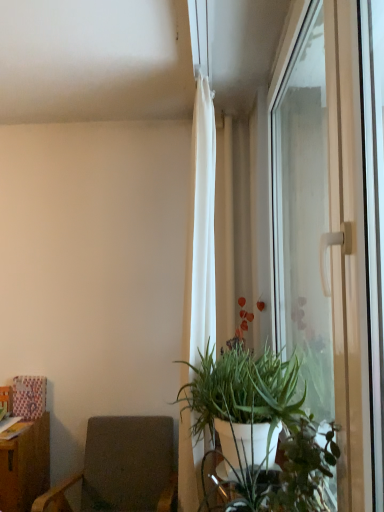
Locate an element on the screen. transparent glass window at right is located at coordinates (335, 233).

Considering the sizes of objects white matte plant pot at lower right and transparent glass window at right in the image provided, who is shorter, white matte plant pot at lower right or transparent glass window at right?

white matte plant pot at lower right is shorter.

Consider the image. Considering their positions, is white matte plant pot at lower right located in front of or behind transparent glass window at right?

white matte plant pot at lower right is positioned farther from the viewer than transparent glass window at right.

The height and width of the screenshot is (512, 384). I want to click on vegetation directly beneath the transparent glass window at right (from a real-world perspective), so click(278, 477).

The width and height of the screenshot is (384, 512). In order to click on vegetation on the right of the dark gray fabric chair at lower left in this screenshot , I will do `click(278, 477)`.

From a real-world perspective, who is located higher, dark gray fabric chair at lower left or white matte plant pot at lower right?

white matte plant pot at lower right is physically above.

Does dark gray fabric chair at lower left have a greater width compared to white matte plant pot at lower right?

Yes.

From the image's perspective, which one is positioned lower, dark gray fabric chair at lower left or white matte plant pot at lower right?

dark gray fabric chair at lower left.

From the image's perspective, who appears lower, green matte plant at center or white matte plant pot at lower right?

green matte plant at center is shown below in the image.

From a real-world perspective, is green matte plant at center located higher than white matte plant pot at lower right?

No, from a real-world perspective, green matte plant at center is not above white matte plant pot at lower right.

How far apart are green matte plant at center and white matte plant pot at lower right?

A distance of 3.08 inches exists between green matte plant at center and white matte plant pot at lower right.

Is green matte plant at center outside of white matte plant pot at lower right?

green matte plant at center is positioned outside white matte plant pot at lower right.

Image resolution: width=384 pixels, height=512 pixels. I want to click on chair below the transparent glass window at right (from a real-world perspective), so [x=122, y=468].

How different are the orientations of dark gray fabric chair at lower left and transparent glass window at right in degrees?

The facing directions of dark gray fabric chair at lower left and transparent glass window at right are 90.3 degrees apart.

Considering the relative sizes of dark gray fabric chair at lower left and transparent glass window at right in the image provided, is dark gray fabric chair at lower left taller than transparent glass window at right?

In fact, dark gray fabric chair at lower left may be shorter than transparent glass window at right.

Is dark gray fabric chair at lower left next to transparent glass window at right and touching it?

dark gray fabric chair at lower left is not next to transparent glass window at right, and they're not touching.

Based on the photo, is green matte plant at center positioned beyond the bounds of white sheer curtain at upper center?

Yes, green matte plant at center is located beyond the bounds of white sheer curtain at upper center.

Can you tell me how much green matte plant at center and white sheer curtain at upper center differ in facing direction?

There is a 0.317-degree angle between the facing directions of green matte plant at center and white sheer curtain at upper center.

Does green matte plant at center appear on the right side of white sheer curtain at upper center?

Correct, you'll find green matte plant at center to the right of white sheer curtain at upper center.

Is point (282, 396) farther from viewer compared to point (188, 507)?

No.

From a real-world perspective, is transparent glass window at right below white sheer curtain at upper center?

No, from a real-world perspective, transparent glass window at right is not below white sheer curtain at upper center.

Is transparent glass window at right positioned with its back to white sheer curtain at upper center?

Yes.

Is transparent glass window at right taller or shorter than white sheer curtain at upper center?

Clearly, transparent glass window at right is shorter compared to white sheer curtain at upper center.

Can you see transparent glass window at right touching white sheer curtain at upper center?

No, transparent glass window at right is not next to white sheer curtain at upper center.

Is dark gray fabric chair at lower left positioned behind white sheer curtain at upper center?

No, dark gray fabric chair at lower left is in front of white sheer curtain at upper center.

Locate an element on the screen. curtain above the dark gray fabric chair at lower left (from a real-world perspective) is located at coordinates tap(201, 230).

What's the angular difference between dark gray fabric chair at lower left and white sheer curtain at upper center's facing directions?

They differ by 90 degrees in their facing directions.

Based on the photo, from a real-world perspective, who is located higher, dark gray fabric chair at lower left or white sheer curtain at upper center?

white sheer curtain at upper center.

What are the coordinates of `vegetation below the transparent glass window at right (from a real-world perspective)` in the screenshot? It's located at (278, 477).

The image size is (384, 512). I want to click on chair that appears on the left of white matte plant pot at lower right, so click(x=122, y=468).

From the image, which object appears to be nearer to white sheer curtain at upper center, dark gray fabric chair at lower left or white matte plant pot at lower right?

Based on the image, dark gray fabric chair at lower left appears to be nearer to white sheer curtain at upper center.

Based on their spatial positions, is dark gray fabric chair at lower left or white sheer curtain at upper center further from green matte plant at center?

dark gray fabric chair at lower left lies further to green matte plant at center than the other object.

Considering their positions, is dark gray fabric chair at lower left positioned further to green matte plant at center than transparent glass window at right?

dark gray fabric chair at lower left lies further to green matte plant at center than the other object.

Which object lies nearer to the anchor point dark gray fabric chair at lower left, transparent glass window at right or green matte plant at center?

The object closer to dark gray fabric chair at lower left is green matte plant at center.

From the image, which object appears to be farther from dark gray fabric chair at lower left, transparent glass window at right or white matte plant pot at lower right?

transparent glass window at right is positioned further to the anchor dark gray fabric chair at lower left.

Looking at the image, which one is located further to transparent glass window at right, white sheer curtain at upper center or dark gray fabric chair at lower left?

dark gray fabric chair at lower left.

Considering their positions, is white matte plant pot at lower right positioned further to white sheer curtain at upper center than dark gray fabric chair at lower left?

Based on the image, white matte plant pot at lower right appears to be further to white sheer curtain at upper center.

Considering their positions, is white matte plant pot at lower right positioned closer to green matte plant at center than white sheer curtain at upper center?

white matte plant pot at lower right.

Find the location of a particular element. The width and height of the screenshot is (384, 512). chair between transparent glass window at right and white sheer curtain at upper center along the z-axis is located at coordinates (122, 468).

The height and width of the screenshot is (512, 384). What are the coordinates of `houseplant positioned between white matte plant pot at lower right and dark gray fabric chair at lower left from near to far` in the screenshot? It's located at (257, 433).

I want to click on vegetation positioned between transparent glass window at right and white sheer curtain at upper center from near to far, so click(278, 477).

Locate an element on the screen. Image resolution: width=384 pixels, height=512 pixels. chair located between white matte plant pot at lower right and white sheer curtain at upper center in the depth direction is located at coordinates point(122,468).